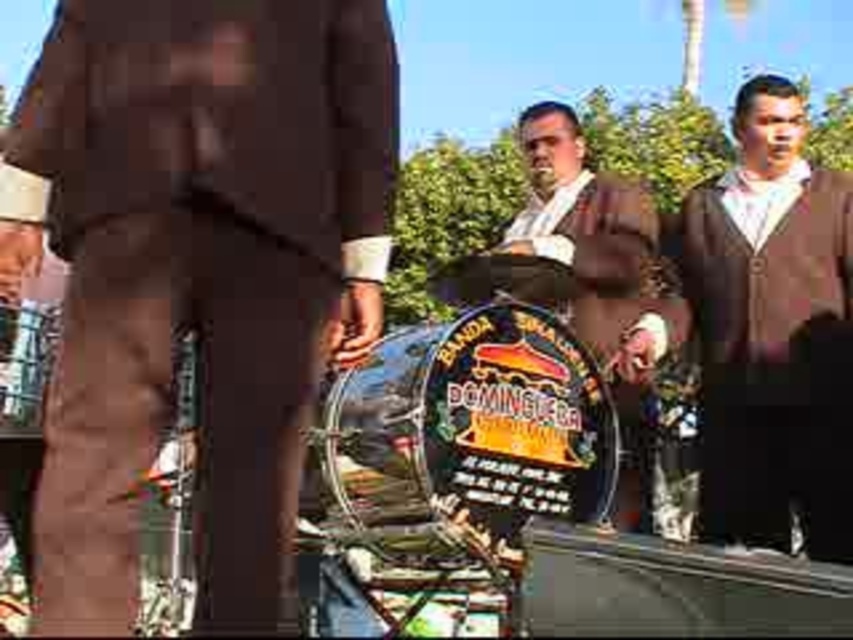
Is brown fabric pants at center smaller than shiny brown leather jacket at center?

Yes, brown fabric pants at center is smaller than shiny brown leather jacket at center.

Measure the distance between brown fabric pants at center and shiny brown leather jacket at center.

A distance of 8.15 feet exists between brown fabric pants at center and shiny brown leather jacket at center.

Between point (115, 525) and point (606, 336), which one is positioned in front?

Point (115, 525)

The image size is (853, 640). I want to click on brown fabric pants at center, so 201,275.

From the picture: Between brown wool sweater at right and shiny brown leather jacket at center, which one has more height?

shiny brown leather jacket at center

Does brown wool sweater at right have a greater height compared to shiny brown leather jacket at center?

In fact, brown wool sweater at right may be shorter than shiny brown leather jacket at center.

Is point (749, 540) closer to viewer compared to point (653, 280)?

Yes, it is in front of point (653, 280).

Where is `brown wool sweater at right`? brown wool sweater at right is located at coordinates (772, 332).

In the scene shown: Who is positioned more to the left, brown fabric pants at center or brown wool sweater at right?

Positioned to the left is brown fabric pants at center.

Between brown fabric pants at center and brown wool sweater at right, which one is positioned higher?

Positioned higher is brown fabric pants at center.

Who is more forward, (x=77, y=541) or (x=849, y=536)?

Point (x=77, y=541)

Identify the location of brown fabric pants at center. This screenshot has width=853, height=640. (201, 275).